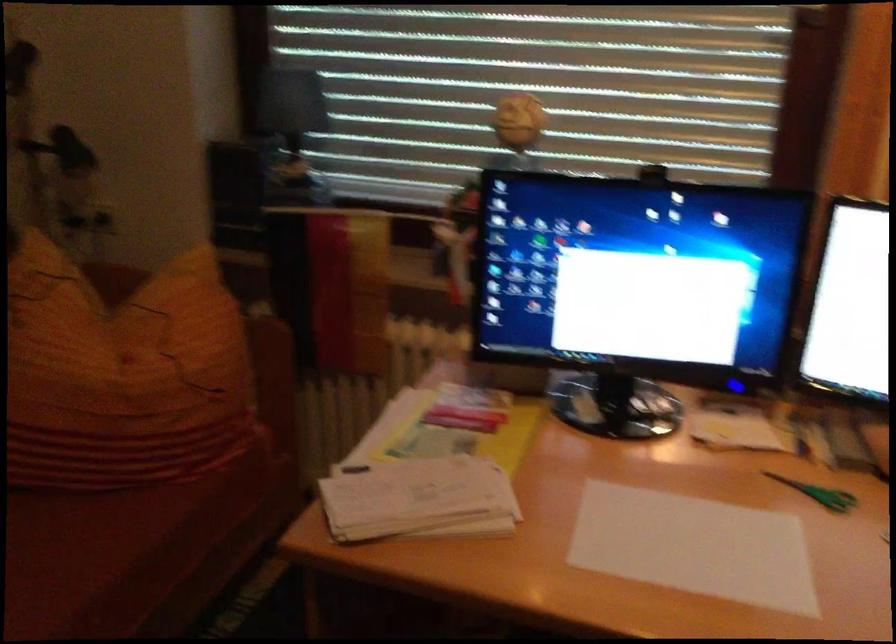
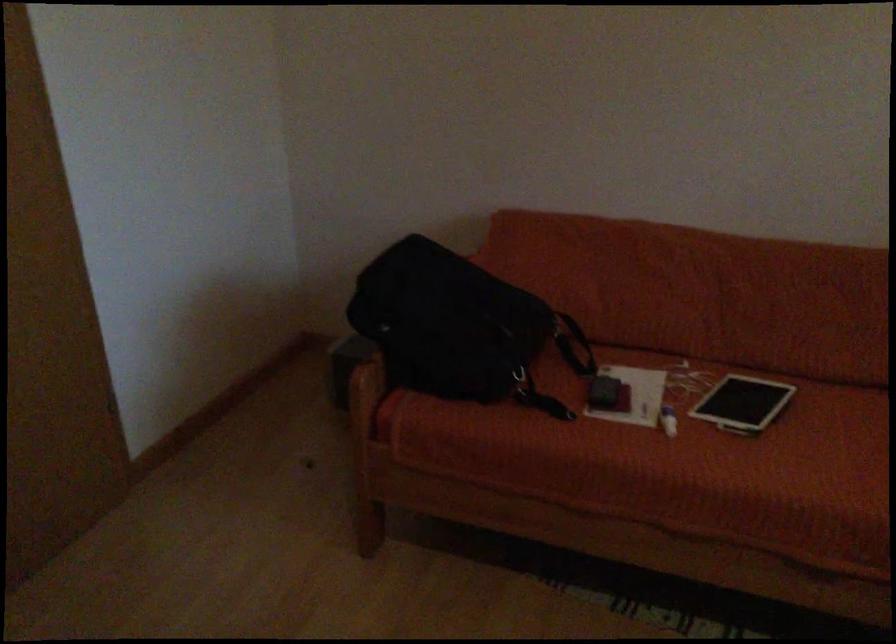
First-person continuous shooting, in which direction is the camera rotating?

The rotation direction of the camera is left-down.